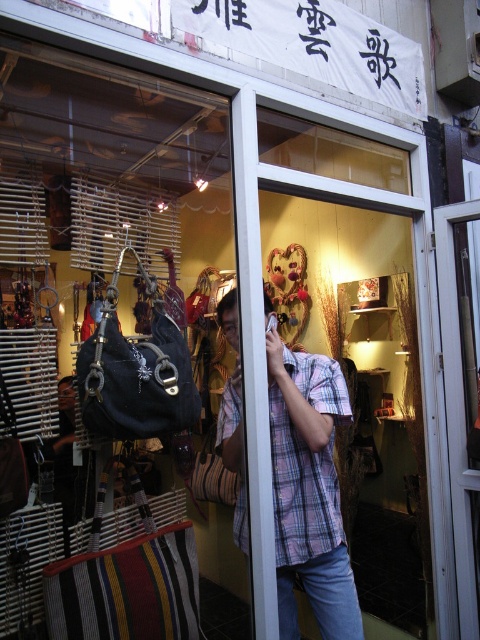
Question: Among these objects, which one is farthest from the camera?

Choices:
 (A) transparent wood glass door at center
 (B) plaid cotton shirt at center

Answer: (A)

Question: Is plaid cotton shirt at center smaller than transparent wood glass door at center?

Choices:
 (A) yes
 (B) no

Answer: (B)

Question: Which of the following is the farthest from the observer?

Choices:
 (A) transparent wood glass door at center
 (B) plaid cotton shirt at center

Answer: (A)

Question: Is plaid cotton shirt at center further to camera compared to transparent wood glass door at center?

Choices:
 (A) no
 (B) yes

Answer: (A)

Question: Can you confirm if plaid cotton shirt at center is wider than transparent wood glass door at center?

Choices:
 (A) yes
 (B) no

Answer: (A)